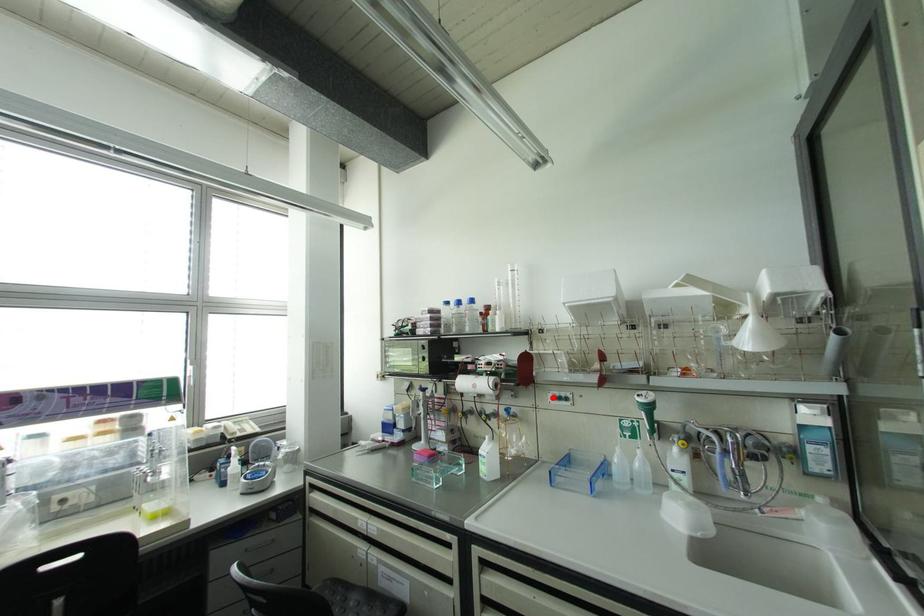
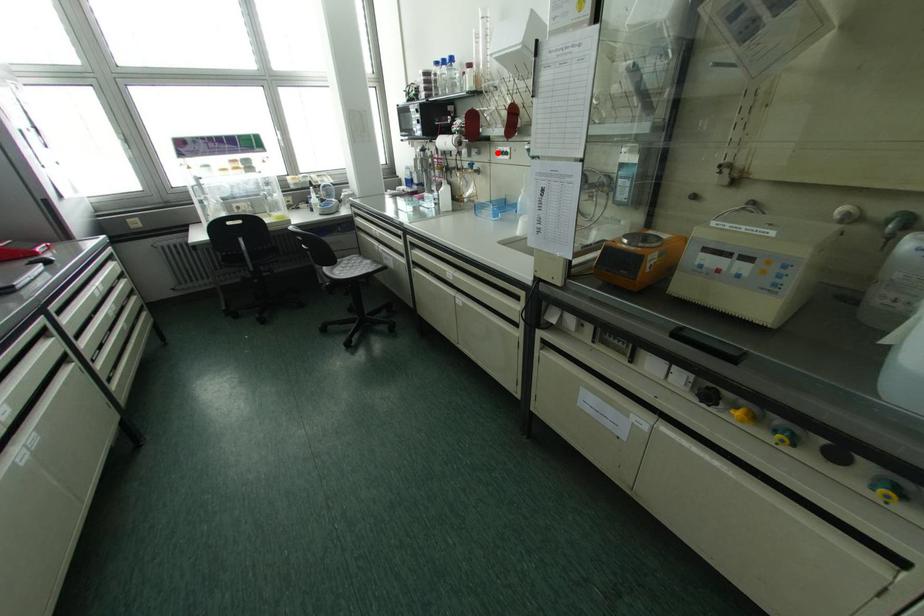
I am providing you with two images of the same scene from different viewpoints. A red point is marked on the first image and another point is marked on the second image. Is the marked point in image1 the same physical position as the marked point in image2?

Yes